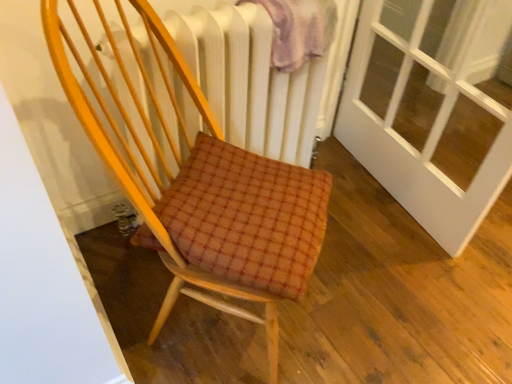
Find the location of `vacant region below wooden chair at center (from a real-world perspective)`. vacant region below wooden chair at center (from a real-world perspective) is located at coordinates (195, 327).